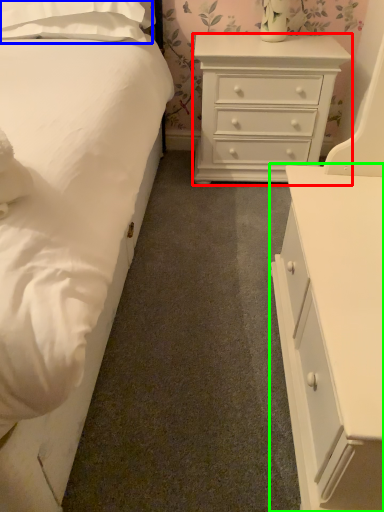
Question: Based on their relative distances, which object is farther from chest of drawers (highlighted by a red box)? Choose from pillow (highlighted by a blue box) and chest of drawers (highlighted by a green box).

Choices:
 (A) pillow
 (B) chest of drawers

Answer: (B)